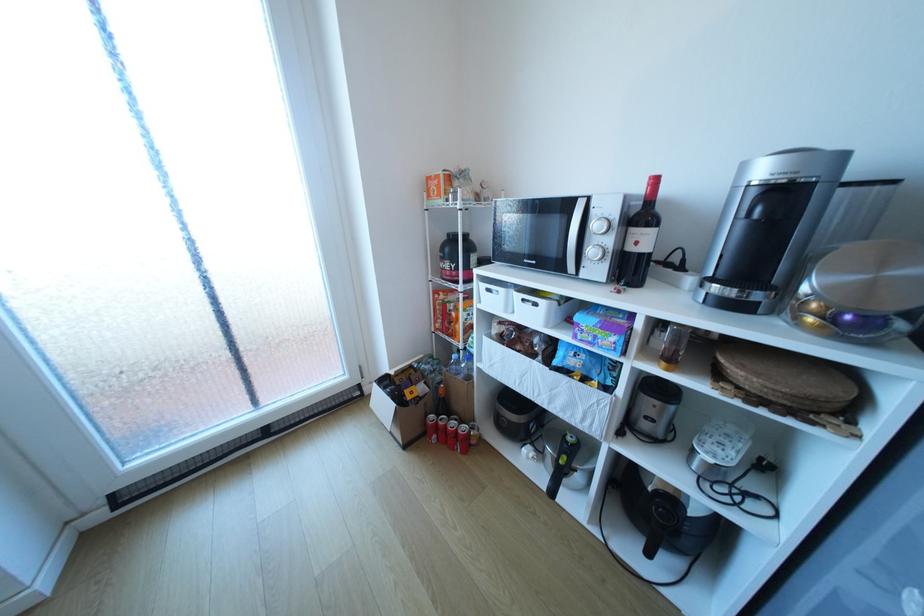
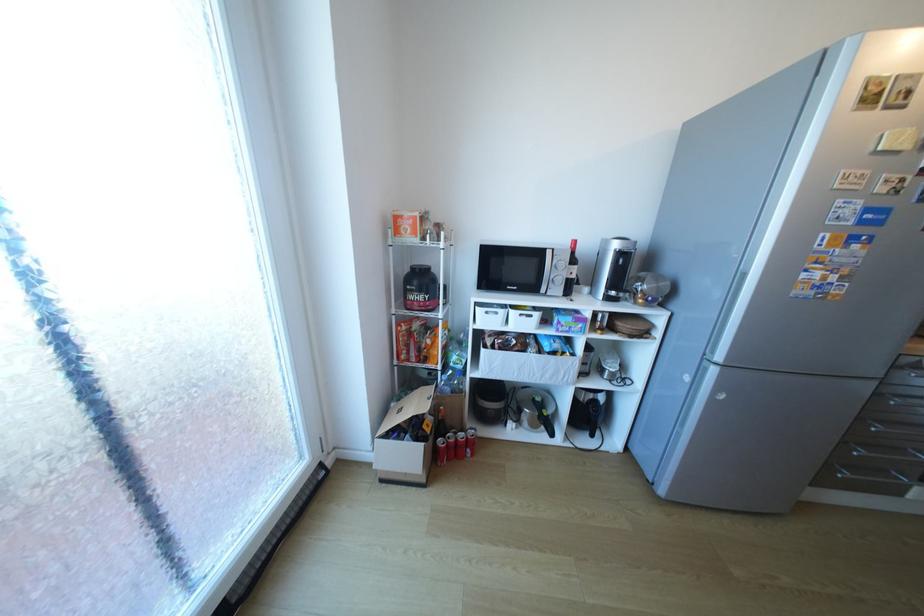
Locate, in the second image, the point that corresponds to [592,256] in the first image.

(560, 282)